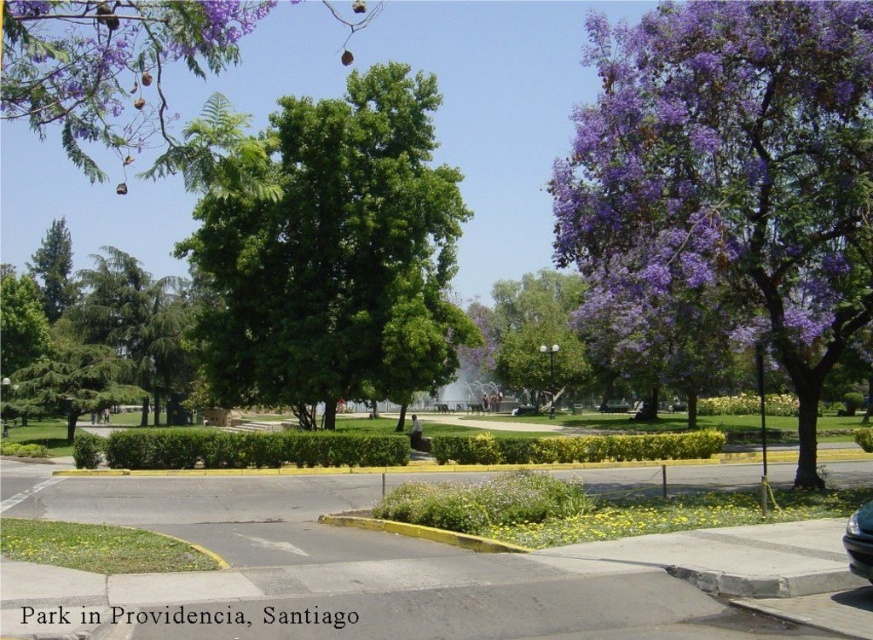
You are a gardener planning to plant a new tree between the green leafy tree at upper left and the green matte tree at left. Based on their widths, which tree should you consider moving closer to for more space?

The green leafy tree at upper left might be wider than the green matte tree at left, so you should consider moving closer to the green matte tree at left to allow more space.

You are a pedestrian standing on the sidewalk near the yellow curb. You see the green leafy tree at center and the shiny black car at lower right. Which object is closer to you?

The green leafy tree at center is closer to you because the shiny black car at lower right is behind it.